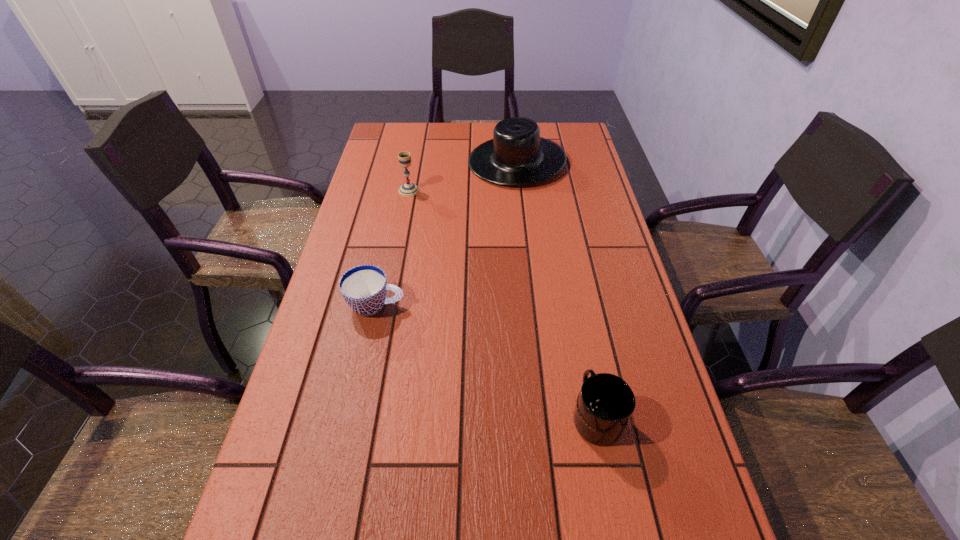
What are the coordinates of `vacant region between the chalice and the third farthest object` in the screenshot? It's located at [393, 248].

Identify the location of vacant space that is in between the nearest object and the chalice. This screenshot has height=540, width=960. (502, 303).

Identify the location of the closest object relative to the nearest object. (364, 288).

The height and width of the screenshot is (540, 960). In order to click on the third closest object to the dress hat in this screenshot , I will do `click(605, 404)`.

You are a GUI agent. You are given a task and a screenshot of the screen. Output one action in this format:
    pyautogui.click(x=<x>, y=<y>)
    Task: Click on the free space that satisfies the following two spatial constraints: 1. on the side of the shortest object with the handle; 2. with the handle on the side of the mug
    The height and width of the screenshot is (540, 960).
    Given the screenshot: What is the action you would take?
    pyautogui.click(x=352, y=416)

You are a GUI agent. You are given a task and a screenshot of the screen. Output one action in this format:
    pyautogui.click(x=<x>, y=<y>)
    Task: Click on the vacant space that satisfies the following two spatial constraints: 1. with the handle on the side of the mug; 2. on the side of the third farthest object with the handle
    This screenshot has width=960, height=540.
    Given the screenshot: What is the action you would take?
    pyautogui.click(x=574, y=305)

Where is `vacant space that satisfies the following two spatial constraints: 1. with the handle on the side of the mug; 2. on the side of the shortest object with the handle`? The height and width of the screenshot is (540, 960). vacant space that satisfies the following two spatial constraints: 1. with the handle on the side of the mug; 2. on the side of the shortest object with the handle is located at coordinates (574, 305).

You are a GUI agent. You are given a task and a screenshot of the screen. Output one action in this format:
    pyautogui.click(x=<x>, y=<y>)
    Task: Click on the blank space that satisfies the following two spatial constraints: 1. with the handle on the side of the nearest object; 2. on the side of the second nearest object with the handle
    The height and width of the screenshot is (540, 960).
    Given the screenshot: What is the action you would take?
    pyautogui.click(x=574, y=305)

Locate an element on the screen. Image resolution: width=960 pixels, height=540 pixels. vacant point that satisfies the following two spatial constraints: 1. on the side of the second nearest object with the handle; 2. with the handle on the side of the mug is located at coordinates (352, 416).

Locate an element on the screen. This screenshot has width=960, height=540. vacant point that satisfies the following two spatial constraints: 1. on the side of the cup with the handle; 2. with the handle on the side of the nearest object is located at coordinates (352, 416).